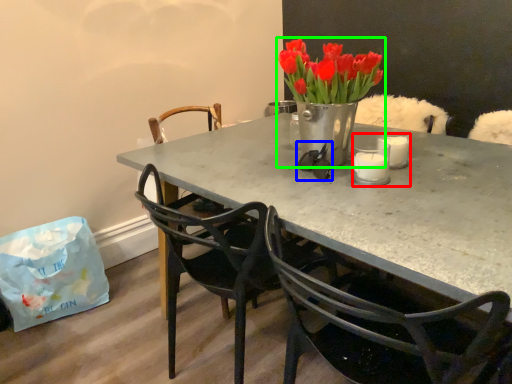
Question: Considering the real-world distances, which object is farthest from candle holder (highlighted by a red box)? glasses (highlighted by a blue box) or houseplant (highlighted by a green box)?

Choices:
 (A) glasses
 (B) houseplant

Answer: (B)